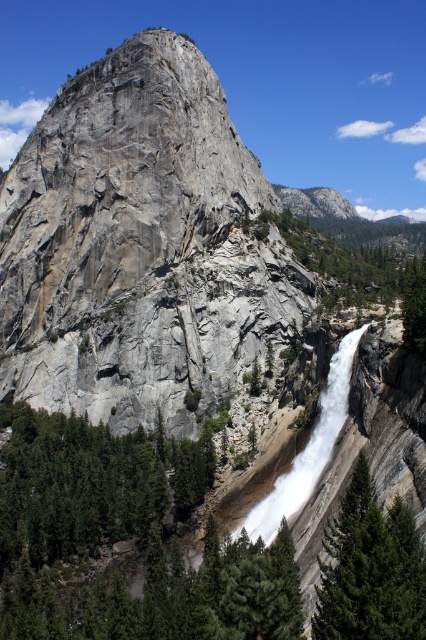
Is green matte tree at lower left shorter than white frothy water at center?

Yes.

Looking at this image, is green matte tree at lower left wider than white frothy water at center?

Correct, the width of green matte tree at lower left exceeds that of white frothy water at center.

Does point (143, 483) come behind point (333, 406)?

Yes, it is behind point (333, 406).

Find the location of a particular element. This screenshot has height=640, width=426. green matte tree at lower left is located at coordinates (89, 483).

Does green textured tree at lower right have a smaller size compared to white frothy water at center?

Yes, green textured tree at lower right is smaller than white frothy water at center.

Between green textured tree at lower right and white frothy water at center, which one appears on the left side from the viewer's perspective?

Positioned to the left is green textured tree at lower right.

Which is in front, point (414, 589) or point (267, 545)?

Point (414, 589) is more forward.

Where is `green textured tree at lower right`? green textured tree at lower right is located at coordinates (371, 570).

Between green matte tree at lower left and green leafy tree at right, which one appears on the left side from the viewer's perspective?

green matte tree at lower left is more to the left.

Who is taller, green matte tree at lower left or green leafy tree at right?

With more height is green leafy tree at right.

This screenshot has height=640, width=426. Find the location of `green matte tree at lower left`. green matte tree at lower left is located at coordinates (89, 483).